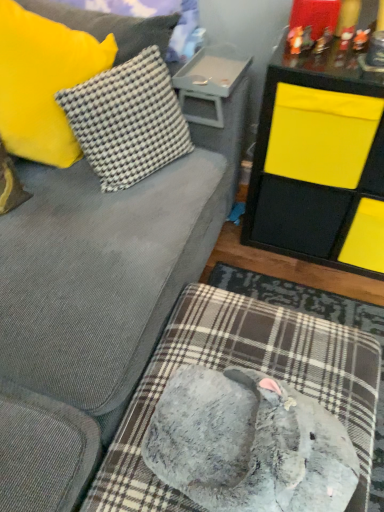
Question: Considering the relative sizes of gray plush dog bed at lower center and yellow matte storage unit at upper right, which is the second table in left-to-right order, in the image provided, is gray plush dog bed at lower center smaller than yellow matte storage unit at upper right, which is the second table in left-to-right order,?

Choices:
 (A) no
 (B) yes

Answer: (B)

Question: Is gray plush dog bed at lower center to the right of yellow matte storage unit at upper right, placed as the first table when sorted from right to left, from the viewer's perspective?

Choices:
 (A) no
 (B) yes

Answer: (A)

Question: Does gray plush dog bed at lower center appear on the left side of yellow matte storage unit at upper right, which is the second table in left-to-right order?

Choices:
 (A) no
 (B) yes

Answer: (B)

Question: Is gray plush dog bed at lower center positioned before yellow matte storage unit at upper right, placed as the first table when sorted from right to left?

Choices:
 (A) no
 (B) yes

Answer: (B)

Question: From a real-world perspective, is gray plush dog bed at lower center on yellow matte storage unit at upper right, placed as the first table when sorted from right to left?

Choices:
 (A) no
 (B) yes

Answer: (A)

Question: Considering the relative sizes of gray plush dog bed at lower center and yellow matte storage unit at upper right, placed as the first table when sorted from right to left, in the image provided, is gray plush dog bed at lower center wider than yellow matte storage unit at upper right, placed as the first table when sorted from right to left,?

Choices:
 (A) yes
 (B) no

Answer: (A)

Question: Considering the relative sizes of plastic tray at upper center, which is the second table from right to left, and white checkered fabric pillow at upper left, the 1th pillow positioned from the right, in the image provided, is plastic tray at upper center, which is the second table from right to left, thinner than white checkered fabric pillow at upper left, the 1th pillow positioned from the right,?

Choices:
 (A) no
 (B) yes

Answer: (A)

Question: Would you say plastic tray at upper center, positioned as the first table in left-to-right order, contains white checkered fabric pillow at upper left, the second pillow viewed from the left?

Choices:
 (A) no
 (B) yes

Answer: (A)

Question: From a real-world perspective, does plastic tray at upper center, which is the second table from right to left, stand above white checkered fabric pillow at upper left, the second pillow viewed from the left?

Choices:
 (A) no
 (B) yes

Answer: (A)

Question: Considering the relative sizes of plastic tray at upper center, positioned as the first table in left-to-right order, and white checkered fabric pillow at upper left, the 1th pillow positioned from the right, in the image provided, is plastic tray at upper center, positioned as the first table in left-to-right order, taller than white checkered fabric pillow at upper left, the 1th pillow positioned from the right,?

Choices:
 (A) yes
 (B) no

Answer: (B)

Question: Is plastic tray at upper center, positioned as the first table in left-to-right order, facing towards white checkered fabric pillow at upper left, the 1th pillow positioned from the right?

Choices:
 (A) yes
 (B) no

Answer: (A)

Question: From the image's perspective, is plastic tray at upper center, positioned as the first table in left-to-right order, over white checkered fabric pillow at upper left, the second pillow viewed from the left?

Choices:
 (A) no
 (B) yes

Answer: (B)

Question: From the image's perspective, does gray plush dog bed at lower center appear lower than yellow fuzzy pillow at upper left, the 1th pillow from the left?

Choices:
 (A) yes
 (B) no

Answer: (A)